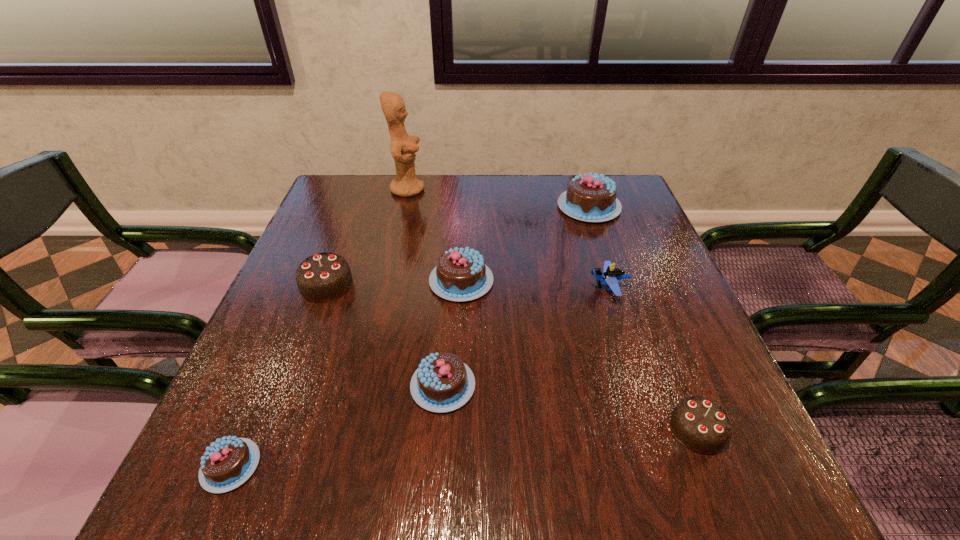
You are a GUI agent. You are given a task and a screenshot of the screen. Output one action in this format:
    pyautogui.click(x=<x>, y=<y>)
    Task: Click on the free space between the second biggest pink chocolate cake and the smaller chocolate chocolate cake
    The height and width of the screenshot is (540, 960).
    Given the screenshot: What is the action you would take?
    pyautogui.click(x=579, y=355)

Locate an element on the screen. Image resolution: width=960 pixels, height=540 pixels. free space between the shortest object and the nearer chocolate chocolate cake is located at coordinates (464, 448).

The width and height of the screenshot is (960, 540). I want to click on free space between the shortest chocolate cake and the farther chocolate chocolate cake, so click(x=278, y=375).

Where is `free spot between the tallest object and the third farthest pink chocolate cake`? The width and height of the screenshot is (960, 540). free spot between the tallest object and the third farthest pink chocolate cake is located at coordinates (425, 287).

Select which object appears as the sixth closest to the figurine. Please provide its 2D coordinates. Your answer should be formatted as a tuple, i.e. [(x, y)], where the tuple contains the x and y coordinates of a point satisfying the conditions above.

[(226, 464)]

At what (x,y) coordinates should I click in order to perform the action: click on object that is the fifth closest one to the shortest object. Please return your answer as a coordinate pair (x, y). The width and height of the screenshot is (960, 540). Looking at the image, I should click on (700, 424).

In order to click on chocolate cake that is the closest to the second smallest pink chocolate cake in this screenshot , I will do `click(461, 274)`.

You are a GUI agent. You are given a task and a screenshot of the screen. Output one action in this format:
    pyautogui.click(x=<x>, y=<y>)
    Task: Click on the chocolate cake that is the fifth nearest to the blue Lego
    
    Given the screenshot: What is the action you would take?
    pyautogui.click(x=323, y=277)

This screenshot has height=540, width=960. I want to click on the third closest pink chocolate cake to the farthest pink chocolate cake, so click(x=226, y=464).

Identify which pink chocolate cake is the nearest to the left chocolate chocolate cake. Please provide its 2D coordinates. Your answer should be formatted as a tuple, i.e. [(x, y)], where the tuple contains the x and y coordinates of a point satisfying the conditions above.

[(461, 274)]